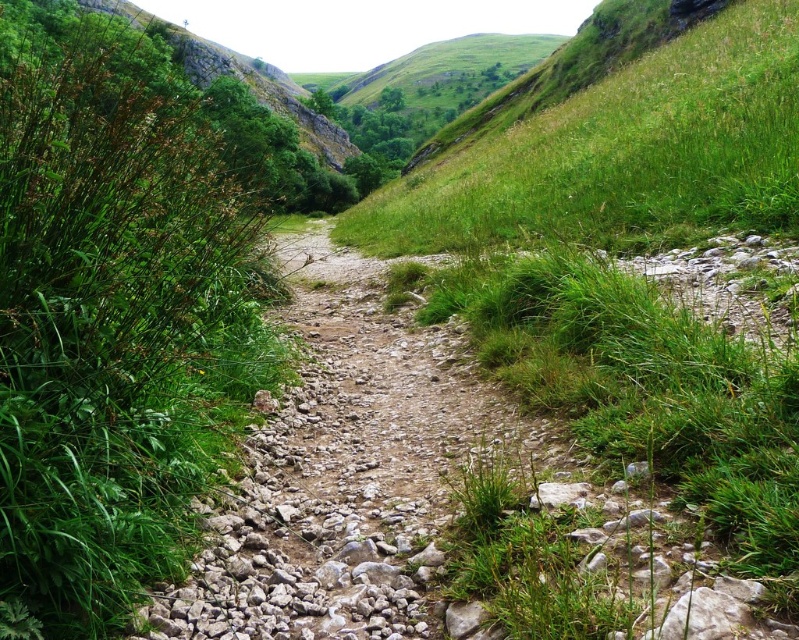
Is green grass at left positioned behind green grassy hillside at upper center?

No.

Which is more to the left, green grass at left or green grassy hillside at upper center?

Positioned to the left is green grass at left.

You are a GUI agent. You are given a task and a screenshot of the screen. Output one action in this format:
    pyautogui.click(x=<x>, y=<y>)
    Task: Click on the green grass at left
    Image resolution: width=799 pixels, height=640 pixels.
    Given the screenshot: What is the action you would take?
    pyautogui.click(x=110, y=316)

Where is `green grass at left`? The image size is (799, 640). green grass at left is located at coordinates (110, 316).